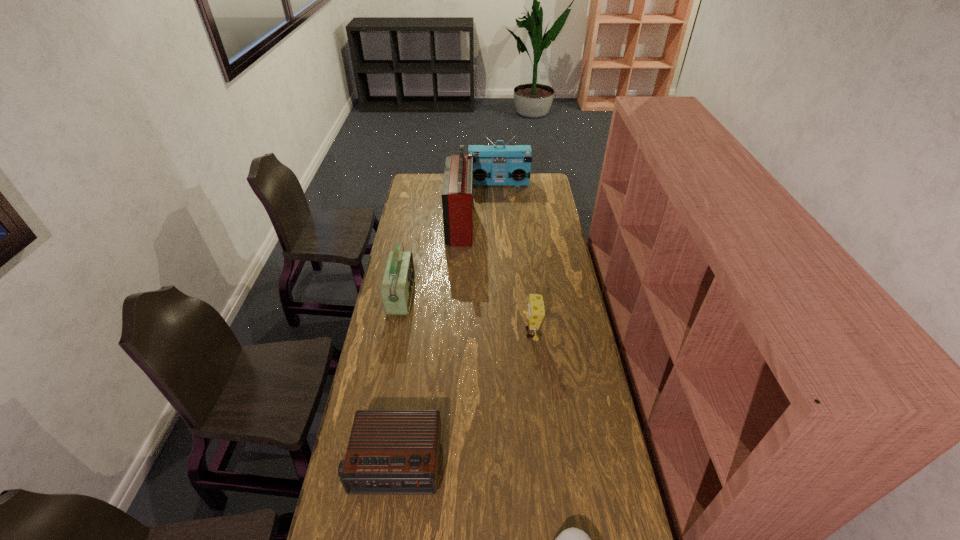
You are a GUI agent. You are given a task and a screenshot of the screen. Output one action in this format:
    pyautogui.click(x=<x>, y=<y>)
    Task: Click on the vacant area situated on the front panel of the third tallest radio receiver
    This screenshot has width=960, height=540.
    Given the screenshot: What is the action you would take?
    pyautogui.click(x=467, y=297)

In order to click on vacant space located 0.220m on the face of the sponge in this screenshot , I will do `click(468, 333)`.

At what (x,y) coordinates should I click in order to perform the action: click on free location located 0.310m on the face of the sponge. Please return your answer as a coordinate pair (x, y). The width and height of the screenshot is (960, 540). Looking at the image, I should click on pos(446,333).

Identify the location of vacant space situated on the face of the sponge. (468, 333).

The width and height of the screenshot is (960, 540). I want to click on vacant space located on the front panel of the second shortest object, so click(x=383, y=539).

Where is `object that is at the far edge`? The image size is (960, 540). object that is at the far edge is located at coordinates (492, 165).

This screenshot has width=960, height=540. What are the coordinates of `object that is at the right edge` in the screenshot? It's located at (492, 165).

The width and height of the screenshot is (960, 540). In order to click on object situated at the far right corner in this screenshot , I will do `click(492, 165)`.

In order to click on vacant space at the left edge of the desktop in this screenshot , I will do click(410, 242).

The width and height of the screenshot is (960, 540). I want to click on vacant area at the right edge, so click(573, 467).